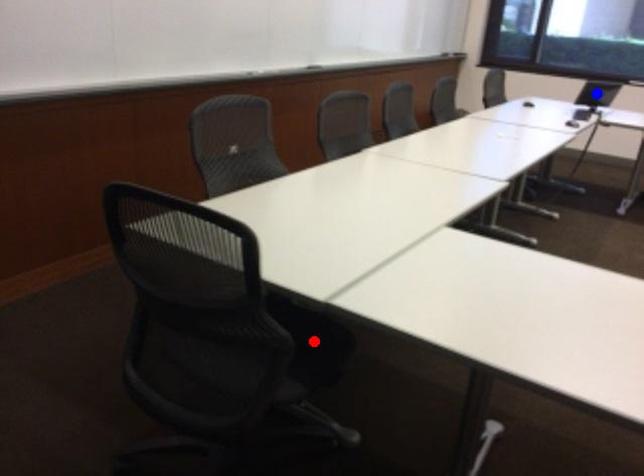
Question: Which of the two points in the image is closer to the camera?

Choices:
 (A) Blue point is closer.
 (B) Red point is closer.

Answer: (B)